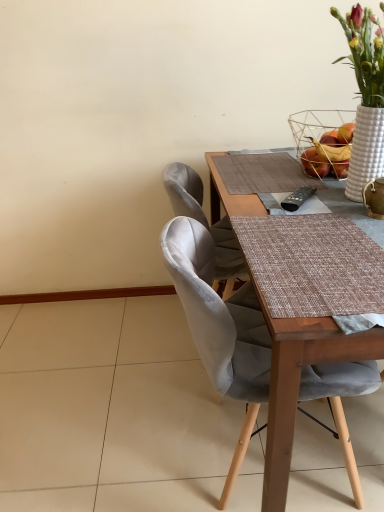
Question: From the image's perspective, is white textured basket at upper right positioned above or below satin grey chair at center?

Choices:
 (A) above
 (B) below

Answer: (A)

Question: Does point (332, 144) appear closer or farther from the camera than point (362, 391)?

Choices:
 (A) farther
 (B) closer

Answer: (A)

Question: Is white textured basket at upper right in front of or behind satin grey chair at center in the image?

Choices:
 (A) front
 (B) behind

Answer: (B)

Question: From a real-world perspective, is satin grey chair at center above or below white textured basket at upper right?

Choices:
 (A) above
 (B) below

Answer: (B)

Question: Is point (243, 379) closer or farther from the camera than point (349, 151)?

Choices:
 (A) farther
 (B) closer

Answer: (B)

Question: From the image's perspective, is satin grey chair at center positioned above or below white textured basket at upper right?

Choices:
 (A) above
 (B) below

Answer: (B)

Question: Considering the positions of satin grey chair at center and white textured basket at upper right in the image, is satin grey chair at center bigger or smaller than white textured basket at upper right?

Choices:
 (A) small
 (B) big

Answer: (B)